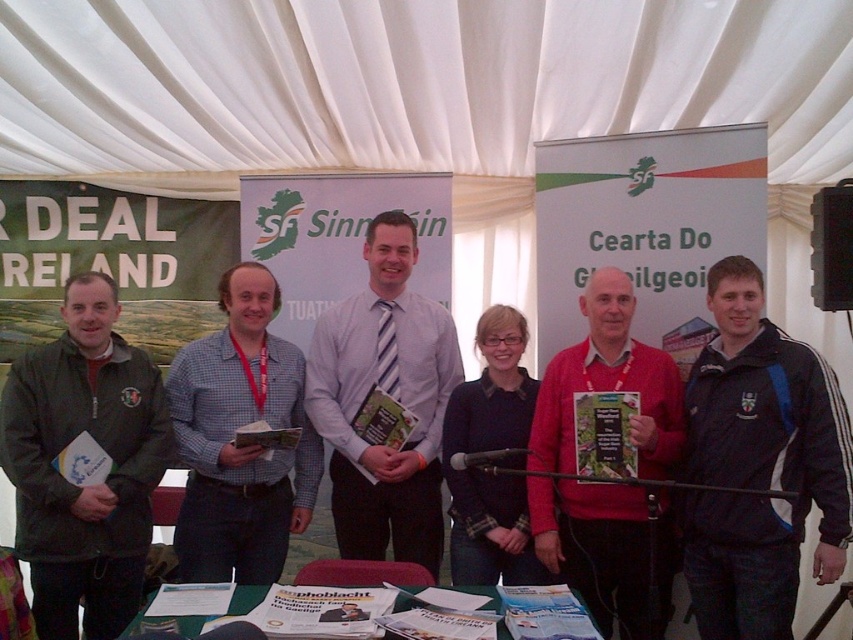
Can you confirm if dark blue jacket at center is positioned to the right of checkered fabric shirt at center?

Yes, dark blue jacket at center is to the right of checkered fabric shirt at center.

Between point (781, 563) and point (294, 362), which one is positioned behind?

Point (294, 362)

Find the location of a particular element. dark blue jacket at center is located at coordinates (759, 465).

The image size is (853, 640). What do you see at coordinates (85, 484) in the screenshot? I see `green matte jacket at left` at bounding box center [85, 484].

Where is `green matte jacket at left`? The image size is (853, 640). green matte jacket at left is located at coordinates (85, 484).

Who is positioned more to the right, dark blue jacket at center or green matte jacket at left?

dark blue jacket at center

Locate an element on the screen. This screenshot has height=640, width=853. dark blue jacket at center is located at coordinates (759, 465).

Identify the location of dark blue jacket at center. Image resolution: width=853 pixels, height=640 pixels. (759, 465).